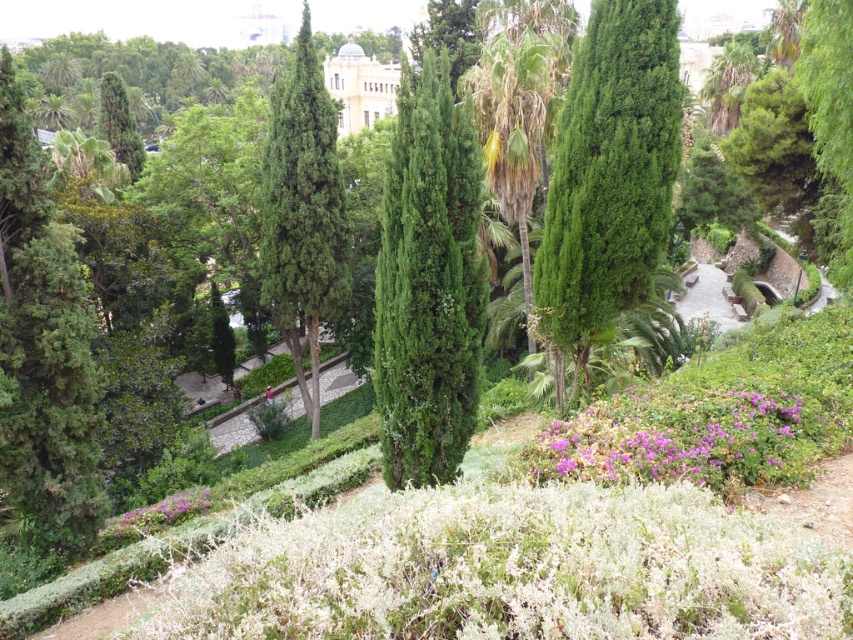
You are a landscape architect designing a new garden layout. You want to place a small bench between the green textured tree at center and the green textured palm tree at center. Which tree should the bench be closer to if you want it to be under the taller tree?

The bench should be placed closer to the green textured palm tree at center because it is taller than the green textured tree at center.